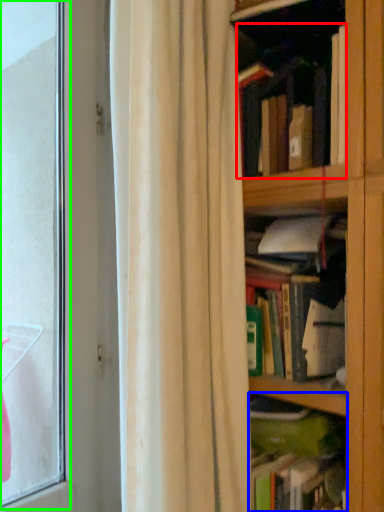
Question: Which is farther away from book (highlighted by a red box)? book (highlighted by a blue box) or bay window (highlighted by a green box)?

Choices:
 (A) book
 (B) bay window

Answer: (B)